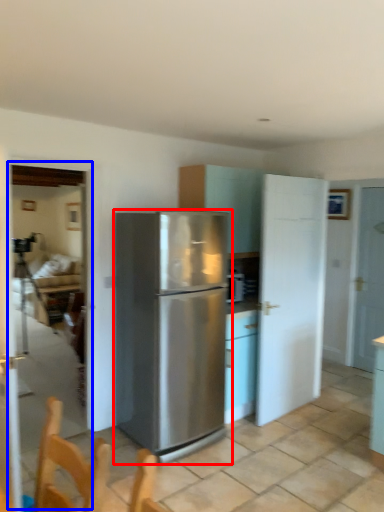
Question: Which object appears farthest to the camera in this image, refrigerator (highlighted by a red box) or glass door (highlighted by a blue box)?

Choices:
 (A) refrigerator
 (B) glass door

Answer: (B)